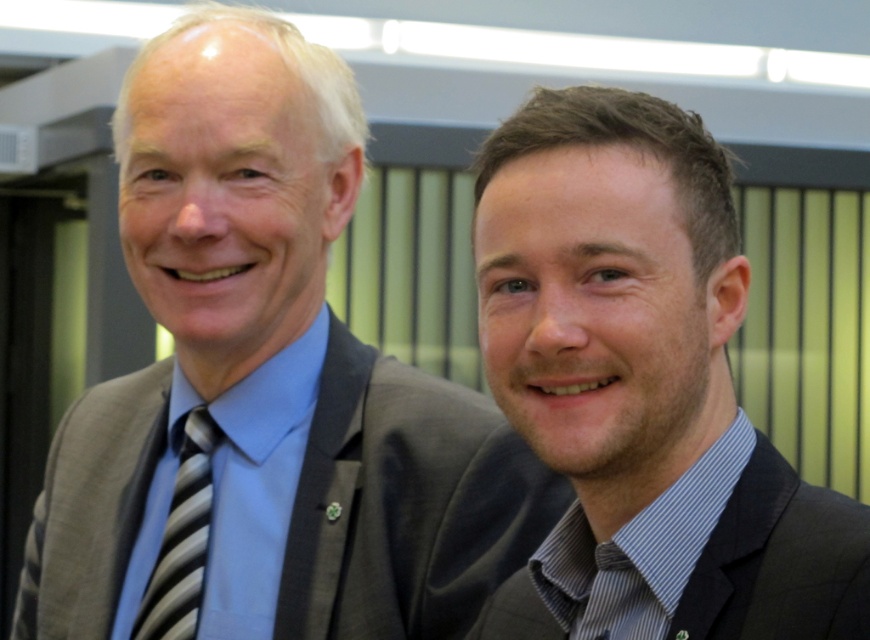
Based on the scene description, where is the dark brown suit at right located in terms of its 2D coordinates?

The dark brown suit at right is located at the 2D coordinates of point (641, 387).